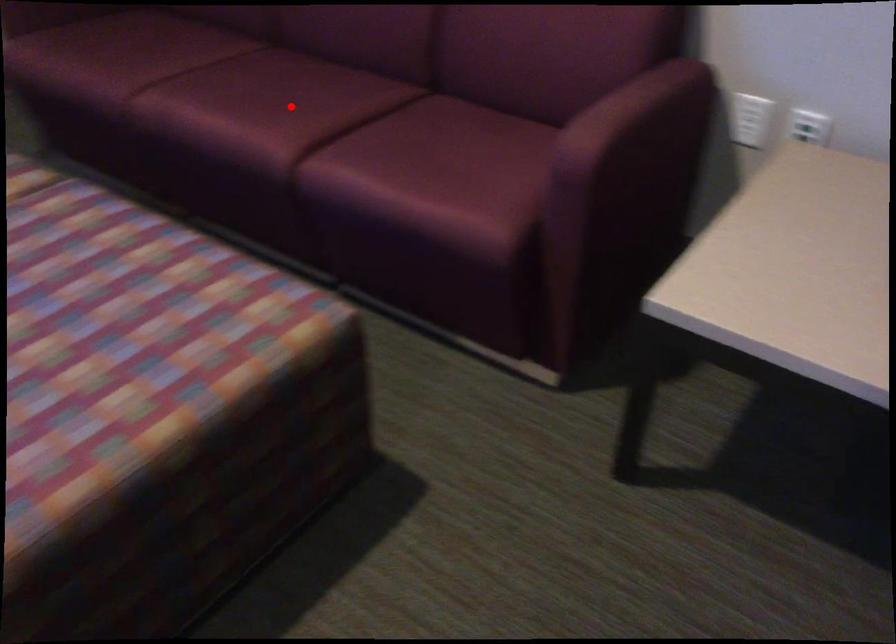
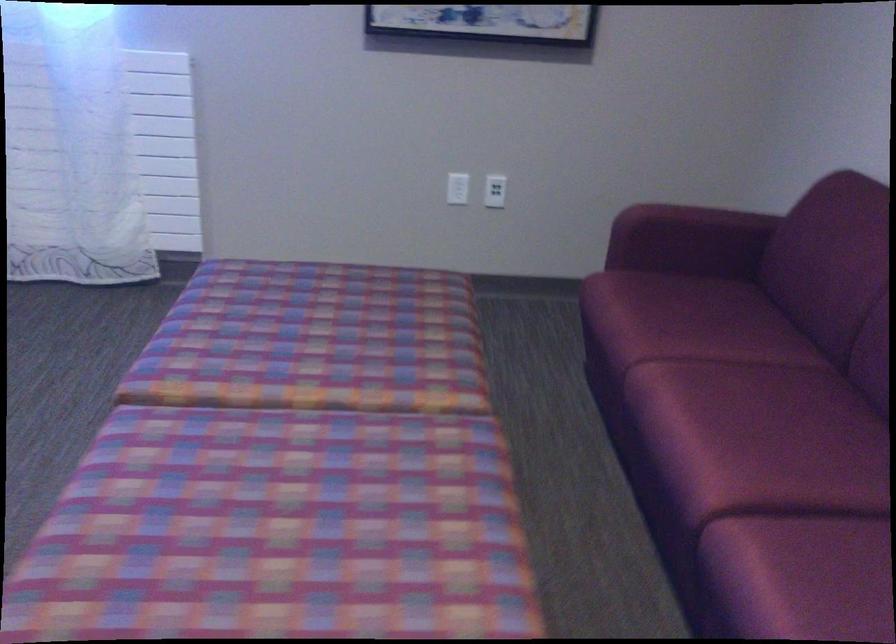
Question: I am providing you with two images of the same scene from different viewpoints. Given a red point in image1, look at the same physical point in image2. Is it:

Choices:
 (A) Closer to the viewpoint
 (B) Farther from the viewpoint

Answer: (A)